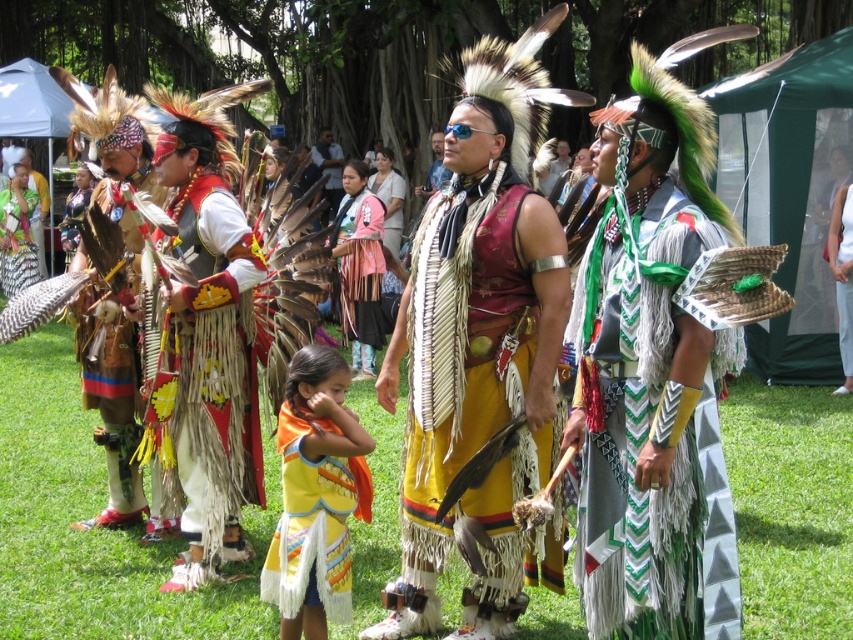
Question: Does yellow fringed skirt at center come in front of orange fabric vest at center?

Choices:
 (A) no
 (B) yes

Answer: (A)

Question: Is green and white woven fabric at right positioned behind yellow fringed vest at center?

Choices:
 (A) yes
 (B) no

Answer: (B)

Question: Which object is positioned farthest from the matte pink fabric dress at center?

Choices:
 (A) matte black shirt at center
 (B) yellow fringed vest at center
 (C) yellow fringed skirt at center
 (D) white cotton dress at center

Answer: (C)

Question: Which of the following is the farthest from the observer?

Choices:
 (A) (339, 276)
 (B) (334, 212)
 (C) (837, 230)

Answer: (B)

Question: Which object appears farthest from the camera in this image?

Choices:
 (A) orange fabric vest at center
 (B) green and white woven fabric at right
 (C) matte black shirt at center
 (D) yellow fringed skirt at center

Answer: (C)

Question: Is green and white woven fabric at right closer to camera compared to matte black shirt at center?

Choices:
 (A) yes
 (B) no

Answer: (A)